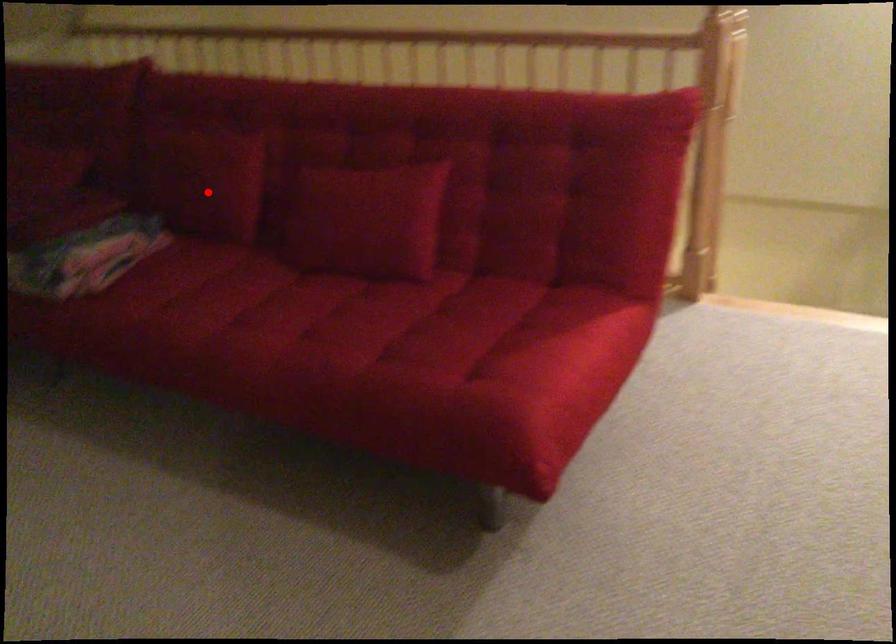
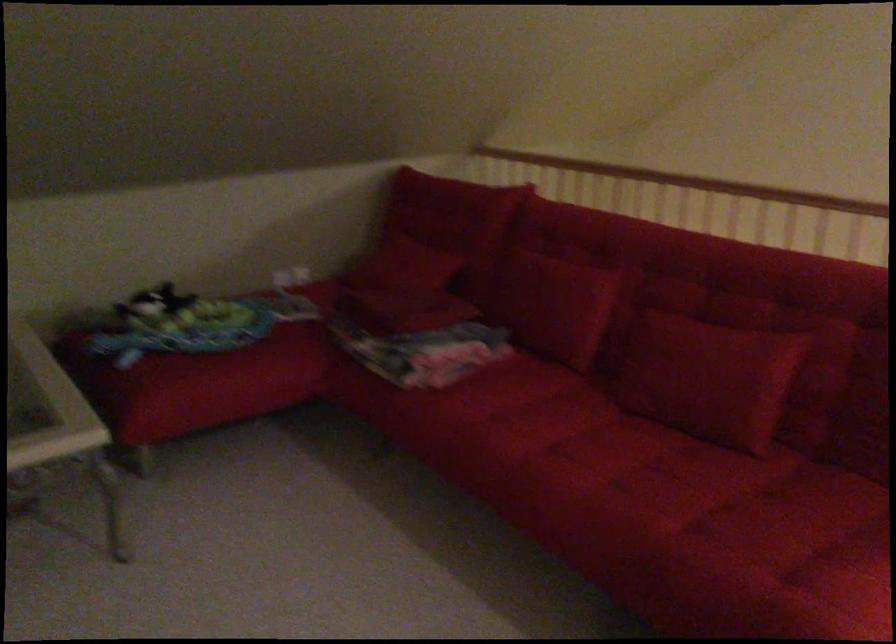
Locate, in the second image, the point that corresponds to the highlighted location in the first image.

(555, 306)